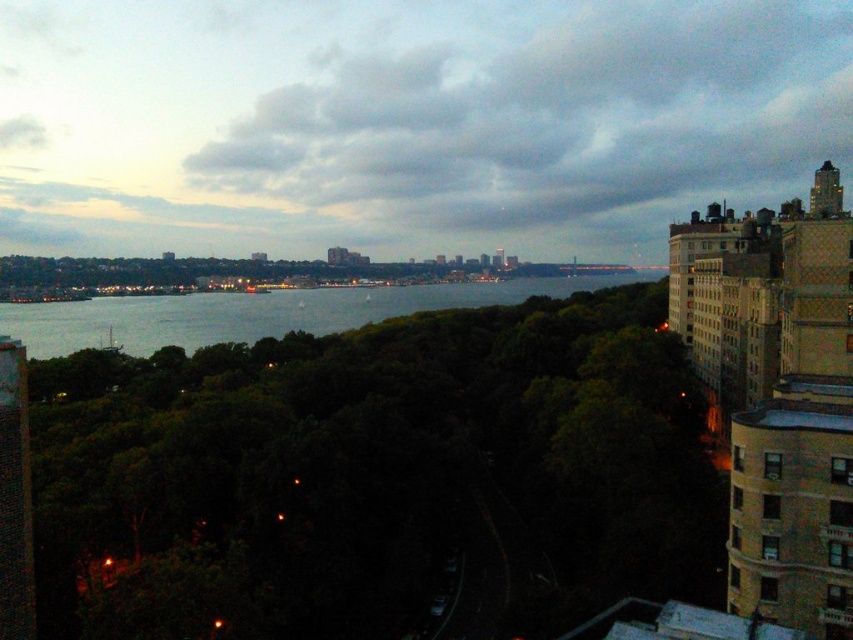
You are a drone operator who needs to fly a drone from the cloudy sky at upper center to the gray water at center. What is the approximate distance you need to cover?

The cloudy sky at upper center is 119.57 meters from the gray water at center, so the drone operator needs to cover approximately 119.57 meters to fly from the cloudy sky at upper center to the gray water at center.

You are an urban planner reviewing this cityscape. You need to determine the spatial relationship between the cloudy sky at upper center and the gray water at center. Which one is wider in the image?

The cloudy sky at upper center is wider than the gray water at center.